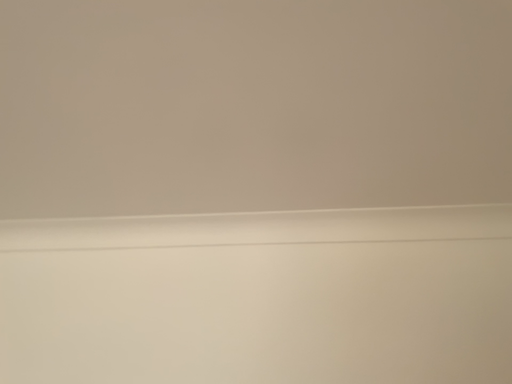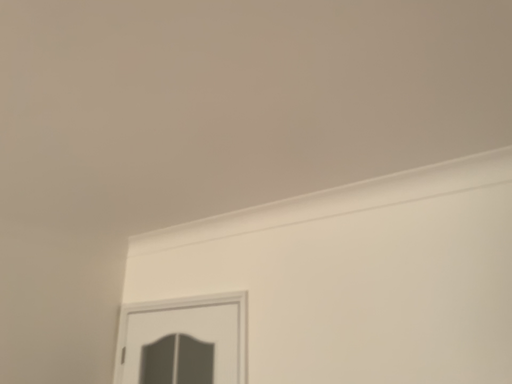
Question: Which way did the camera rotate in the video?

Choices:
 (A) rotated right
 (B) rotated left

Answer: (B)